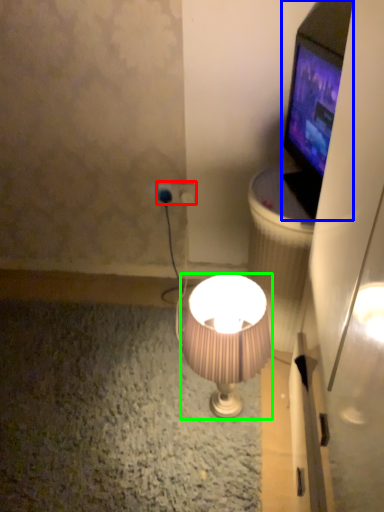
Question: Considering the real-world distances, which object is farthest from power plugs and sockets (highlighted by a red box)? television (highlighted by a blue box) or lamp (highlighted by a green box)?

Choices:
 (A) television
 (B) lamp

Answer: (B)